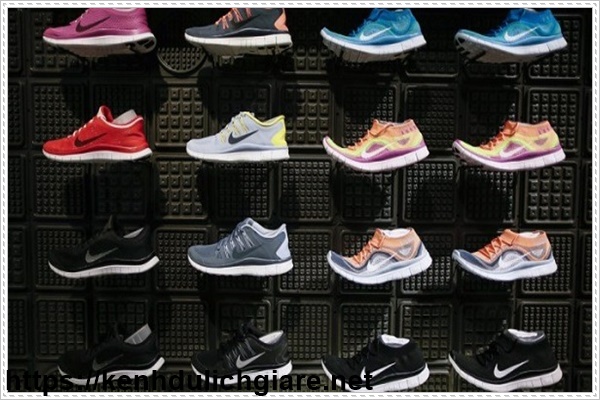
The width and height of the screenshot is (600, 400). I want to click on shoes on the bottom row, so pyautogui.click(x=104, y=364), pyautogui.click(x=251, y=357), pyautogui.click(x=367, y=360), pyautogui.click(x=486, y=357).